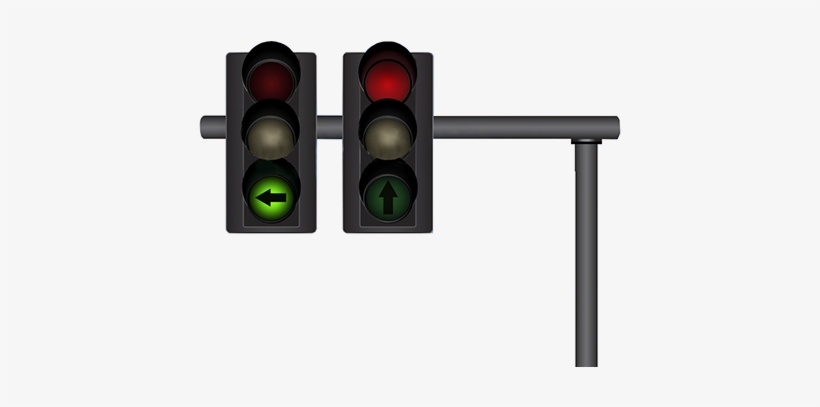
Locate an element on the screen. green light is located at coordinates (x=272, y=206).